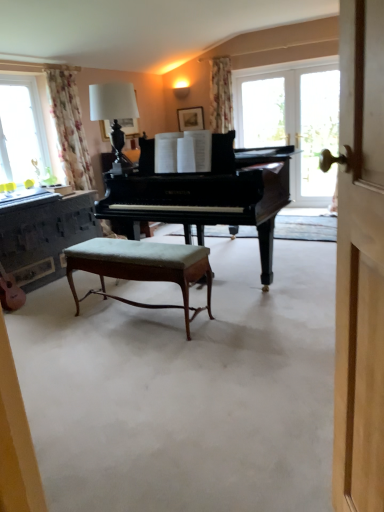
Where is `free space that is to the left of green fabric stool at center`? The image size is (384, 512). free space that is to the left of green fabric stool at center is located at coordinates (59, 330).